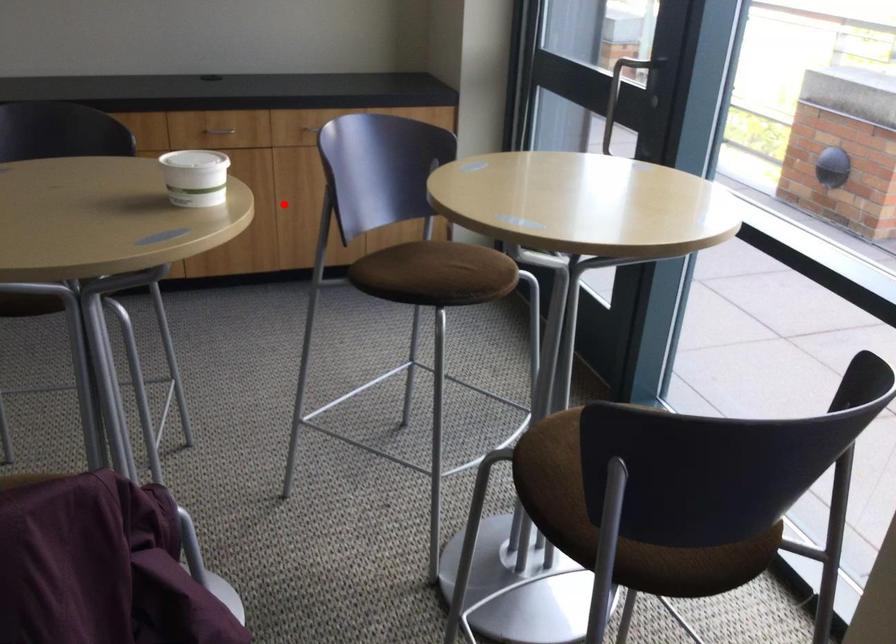
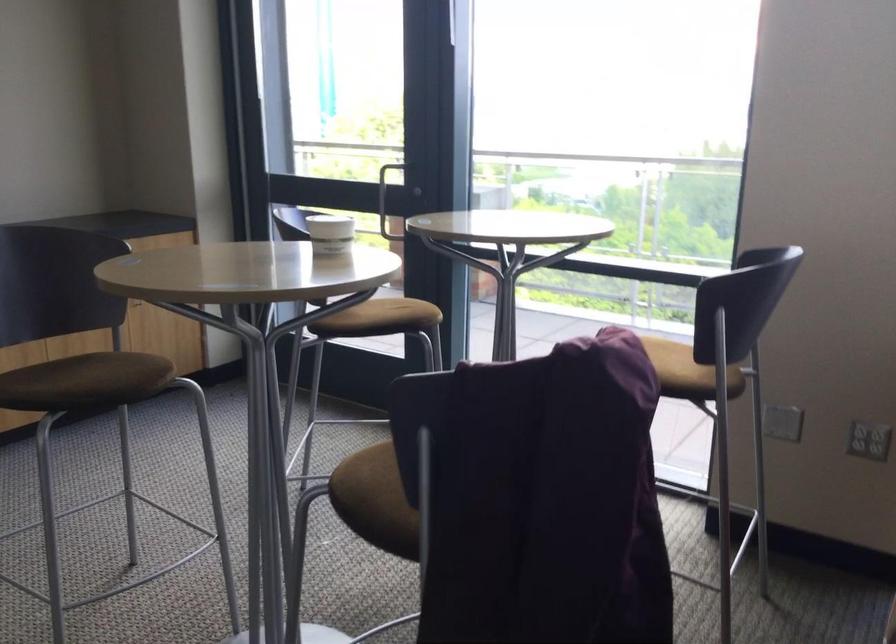
The point at the highlighted location is marked in the first image. Where is the corresponding point in the second image?

(76, 344)